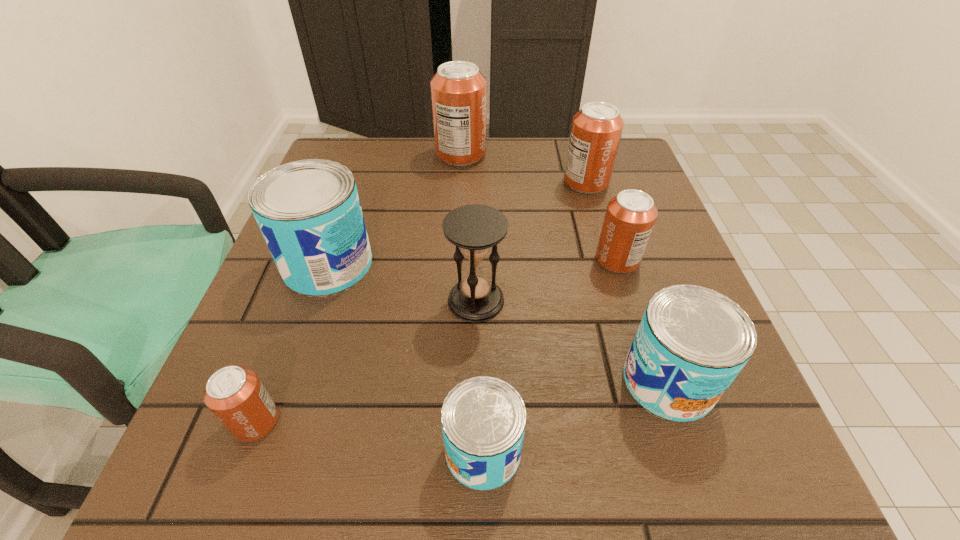
Find the location of a particular element. the nearest orange can is located at coordinates (235, 395).

The image size is (960, 540). I want to click on the second blue can from left to right, so coord(483,419).

At what (x,y) coordinates should I click in order to perform the action: click on free location located 0.400m on the front of the tallest can. Please return your answer as a coordinate pair (x, y). This screenshot has width=960, height=540. Looking at the image, I should click on (453, 288).

Locate an element on the screen. Image resolution: width=960 pixels, height=540 pixels. free space located 0.080m on the left of the second farthest can is located at coordinates (530, 183).

The height and width of the screenshot is (540, 960). I want to click on vacant space located on the back of the farthest blue can, so click(364, 158).

You are a GUI agent. You are given a task and a screenshot of the screen. Output one action in this format:
    pyautogui.click(x=<x>, y=<y>)
    Task: Click on the vacant space situated 0.050m on the left of the hourglass
    Image resolution: width=960 pixels, height=540 pixels.
    Given the screenshot: What is the action you would take?
    pyautogui.click(x=420, y=301)

Identify the location of blank area located 0.280m on the back of the second nearest orange can. (588, 169).

Locate an element on the screen. This screenshot has height=540, width=960. free point located on the left of the rightmost blue can is located at coordinates (415, 381).

Where is `vacant space located 0.310m on the right of the nearest orange can`? The image size is (960, 540). vacant space located 0.310m on the right of the nearest orange can is located at coordinates (495, 422).

What are the coordinates of `vacant space situated 0.280m on the right of the second blue can from right to left` in the screenshot? It's located at (727, 451).